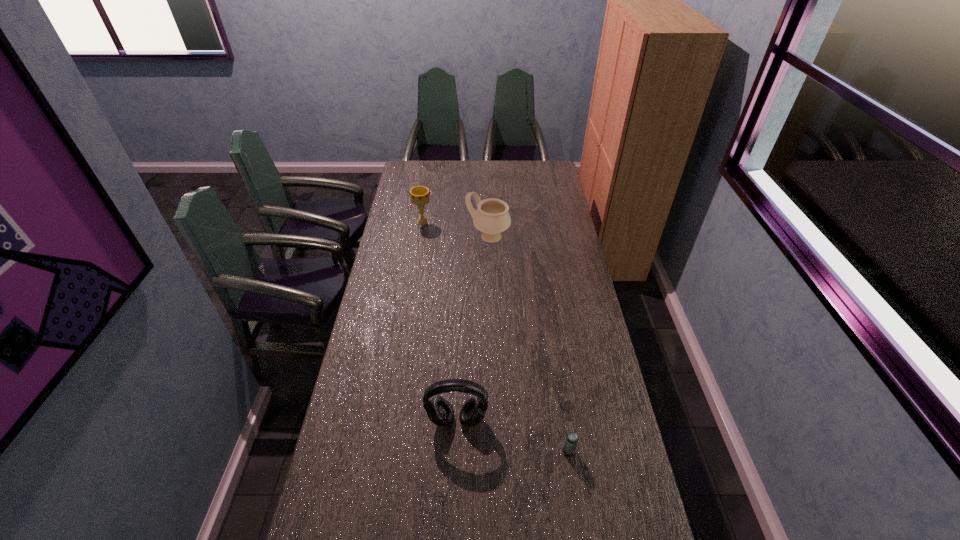
You are a GUI agent. You are given a task and a screenshot of the screen. Output one action in this format:
    pyautogui.click(x=<x>, y=<y>)
    Task: Click on the free space between the chalice and the headset
    Image resolution: width=960 pixels, height=540 pixels.
    Given the screenshot: What is the action you would take?
    pyautogui.click(x=440, y=321)

The image size is (960, 540). I want to click on vacant point located between the headset and the chalice, so click(x=440, y=321).

The image size is (960, 540). In order to click on vacant space in between the chalice and the beer can in this screenshot , I will do `click(495, 337)`.

Identify the location of vacant region between the second nearest object and the leftmost object. [440, 321].

Point out which object is positioned as the nearest to the second nearest object. Please provide its 2D coordinates. Your answer should be formatted as a tuple, i.e. [(x, y)], where the tuple contains the x and y coordinates of a point satisfying the conditions above.

[(571, 440)]

Select which object appears as the third closest to the leftmost object. Please provide its 2D coordinates. Your answer should be formatted as a tuple, i.e. [(x, y)], where the tuple contains the x and y coordinates of a point satisfying the conditions above.

[(571, 440)]

Where is `vacant region that satisfies the following two spatial constraints: 1. on the earcups of the second nearest object; 2. on the left side of the shortest object`? The image size is (960, 540). vacant region that satisfies the following two spatial constraints: 1. on the earcups of the second nearest object; 2. on the left side of the shortest object is located at coordinates (456, 451).